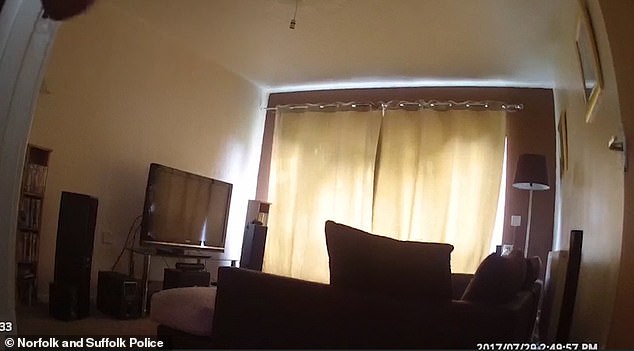
Locate an element on the screen. The image size is (634, 351). white ceiling is located at coordinates (378, 32).